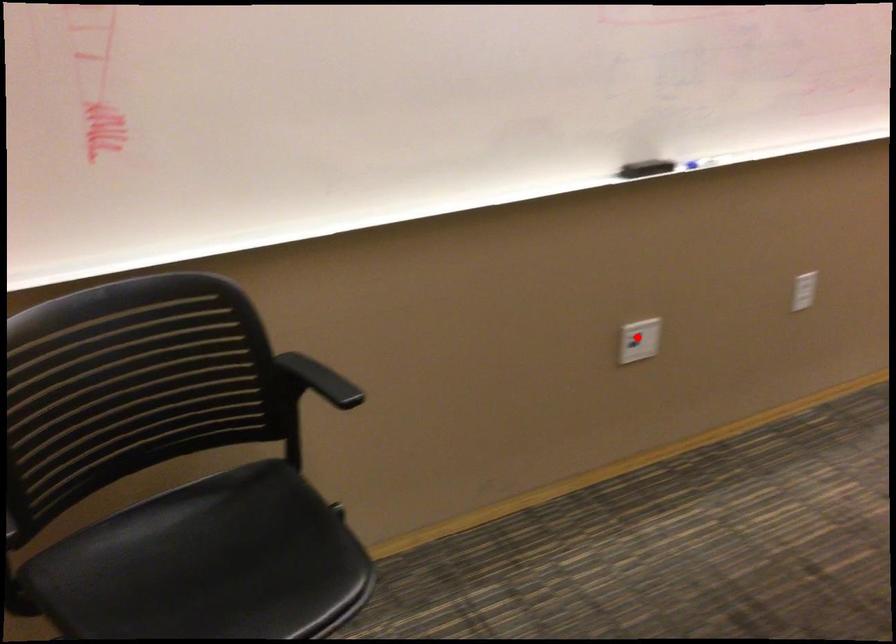
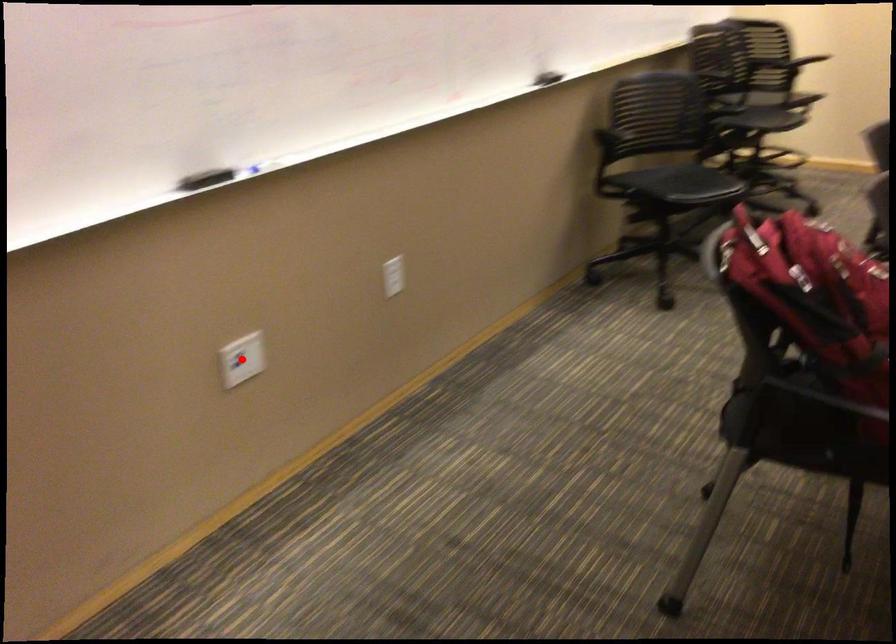
From the picture: I am providing you with two images of the same scene from different viewpoints. A red point is marked on the first image and another point is marked on the second image. Is the red point in image1 aligned with the point shown in image2?

Yes